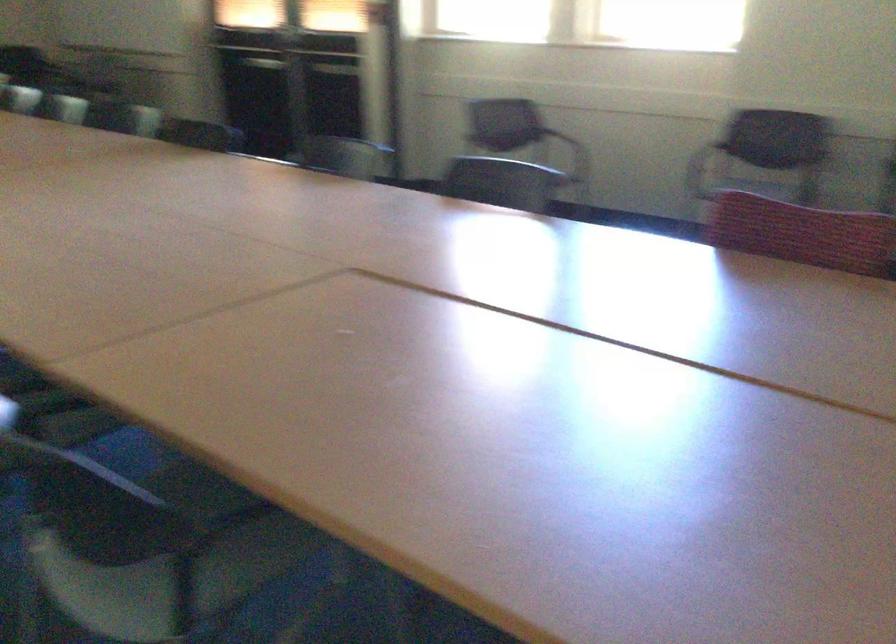
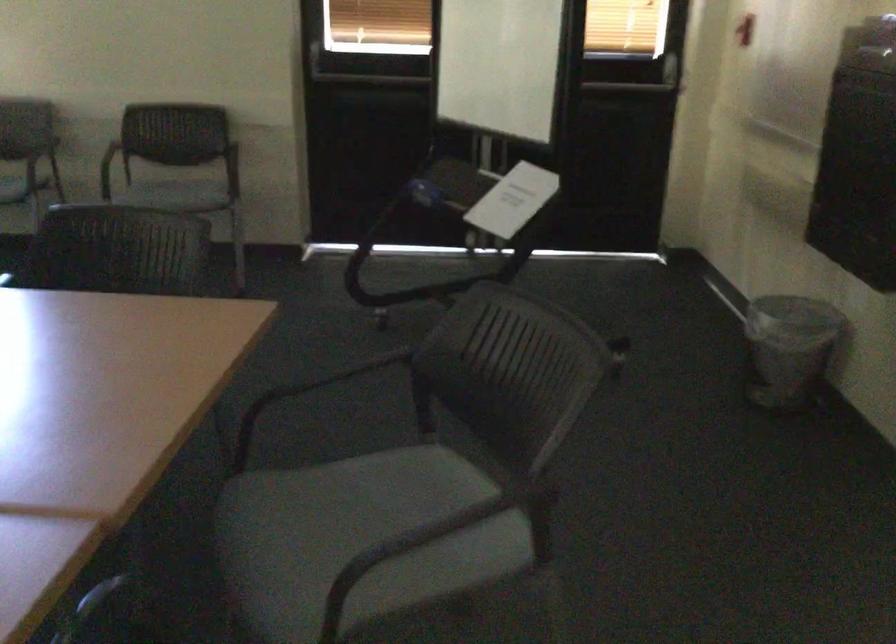
Question: The images are taken continuously from a first-person perspective. In which direction is your viewpoint rotating?

Choices:
 (A) Left
 (B) Right
 (C) Up
 (D) Down

Answer: (B)